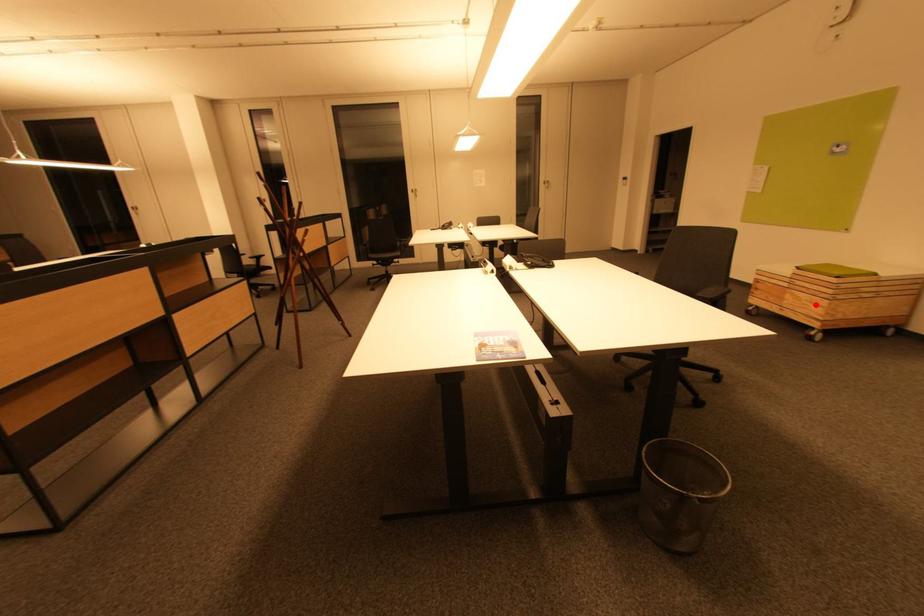
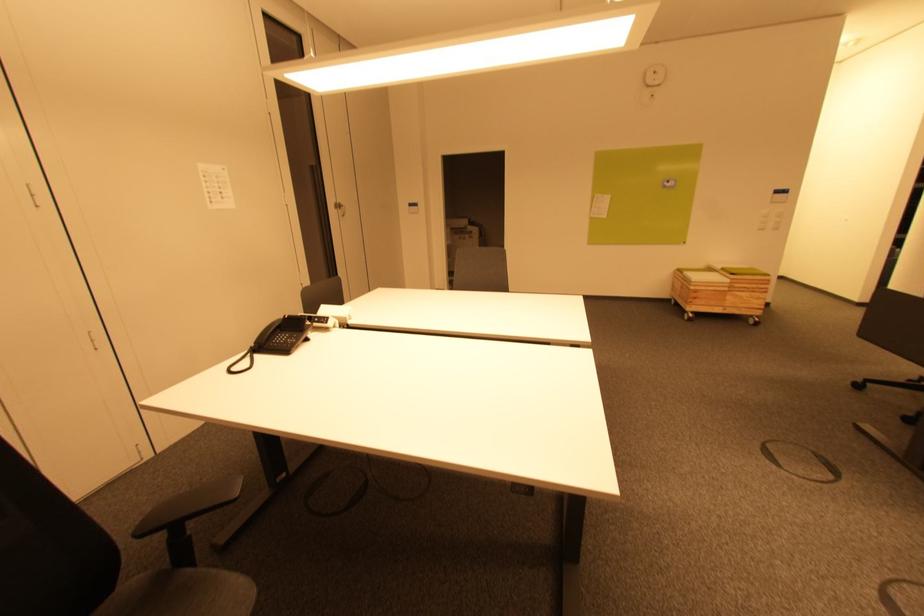
Where in the second image is the point corresponding to the highlighted location from the first image?

(756, 300)